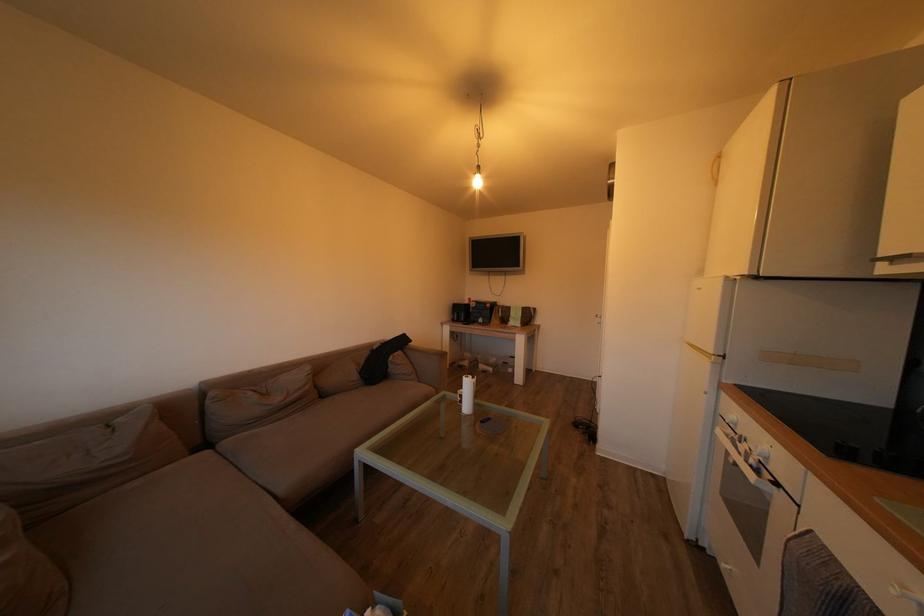
This screenshot has width=924, height=616. What do you see at coordinates (738, 464) in the screenshot?
I see `the white oven handle` at bounding box center [738, 464].